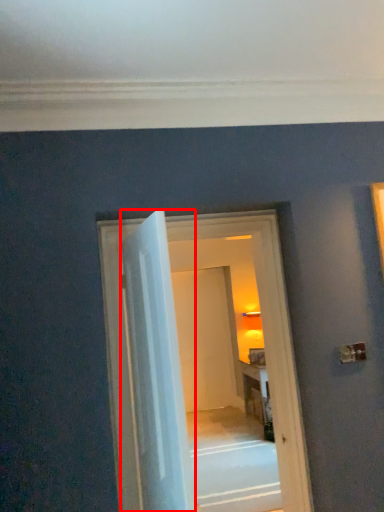
Question: From the image's perspective, considering the relative positions of door (annotated by the red box) and door in the image provided, where is door (annotated by the red box) located with respect to the staircase?

Choices:
 (A) above
 (B) below

Answer: (A)